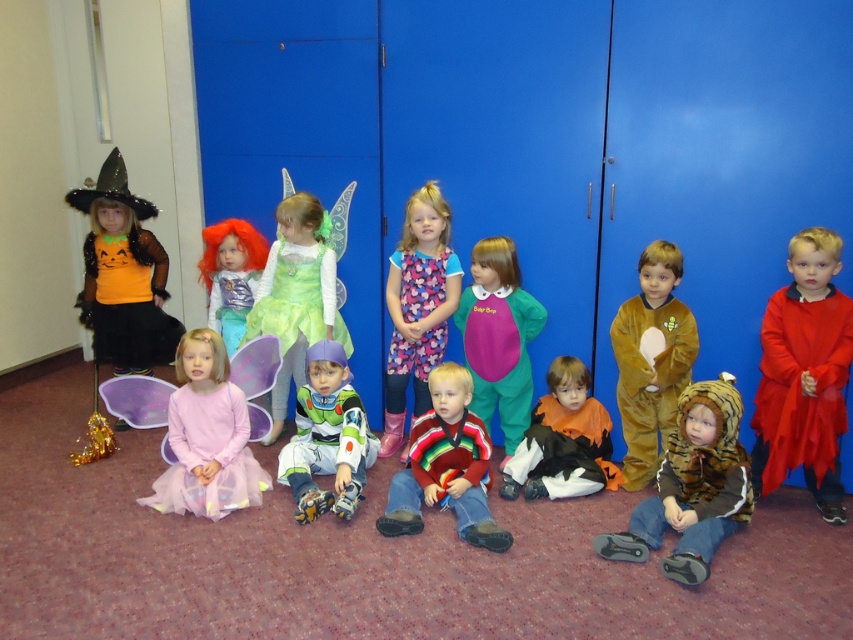
Question: Which object appears closest to the camera in this image?

Choices:
 (A) shiny silver helmet at center
 (B) matte purple costume at center
 (C) striped fur coat at lower center

Answer: (C)

Question: Considering the relative positions of green satin dress at center and matte orange tulle skirt at left in the image provided, where is green satin dress at center located with respect to matte orange tulle skirt at left?

Choices:
 (A) below
 (B) above

Answer: (A)

Question: Which object is the closest to the pink tulle dress at center?

Choices:
 (A) striped fur coat at lower center
 (B) floral dress at center
 (C) shiny silver helmet at center

Answer: (C)

Question: Can you confirm if floral dress at center is positioned above matte purple costume at center?

Choices:
 (A) no
 (B) yes

Answer: (B)

Question: Is red velvet cape at right above striped sweater at center?

Choices:
 (A) no
 (B) yes

Answer: (B)

Question: Which object is the farthest from the fluffy pink dress at center?

Choices:
 (A) shiny silver helmet at center
 (B) shiny orange wig at center
 (C) orange felt costume at center
 (D) matte orange tulle skirt at left

Answer: (D)